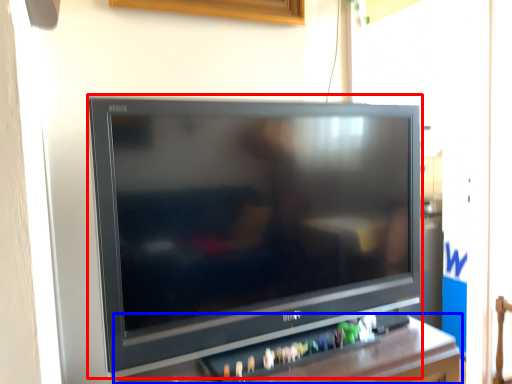
Question: Which point is closer to the camera, television (highlighted by a red box) or furniture (highlighted by a blue box)?

Choices:
 (A) television
 (B) furniture

Answer: (B)